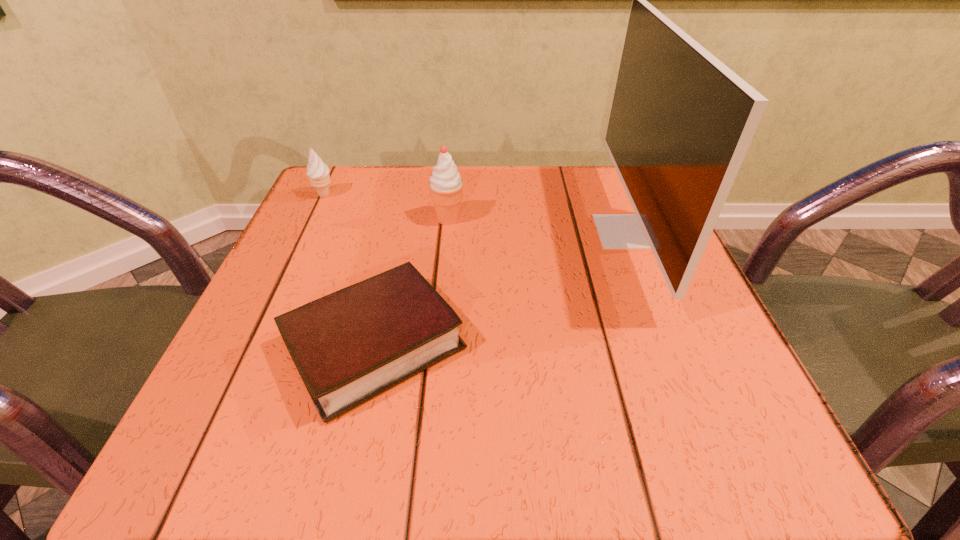
You are a GUI agent. You are given a task and a screenshot of the screen. Output one action in this format:
    pyautogui.click(x=<x>, y=<y>)
    Task: Click on the vacant space situated 0.290m on the front of the nearer icecream
    The image size is (960, 540).
    Given the screenshot: What is the action you would take?
    pyautogui.click(x=437, y=345)

At what (x,y) coordinates should I click in order to perform the action: click on free space located on the front-facing side of the shorter icecream. Please return your answer as a coordinate pair (x, y). Looking at the image, I should click on (314, 218).

Locate an element on the screen. Image resolution: width=960 pixels, height=540 pixels. blank space located on the back of the shortest object is located at coordinates (399, 234).

Identify the location of monitor present at the far edge. The width and height of the screenshot is (960, 540). (681, 122).

The height and width of the screenshot is (540, 960). Find the location of `object located at the near edge`. object located at the near edge is located at coordinates (349, 346).

In order to click on icecream situated at the left edge in this screenshot , I will do `click(318, 172)`.

Locate an element on the screen. The width and height of the screenshot is (960, 540). Bible at the left edge is located at coordinates (349, 346).

Locate an element on the screen. The image size is (960, 540). object that is at the right edge is located at coordinates (681, 122).

This screenshot has width=960, height=540. I want to click on object that is at the far left corner, so click(318, 172).

At what (x,y) coordinates should I click in order to perform the action: click on object that is at the near left corner. Please return your answer as a coordinate pair (x, y). This screenshot has height=540, width=960. Looking at the image, I should click on (349, 346).